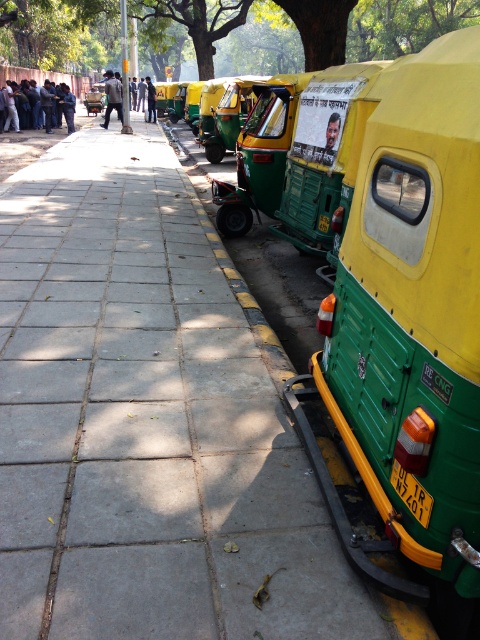
You are standing on the pavement near the auto rickshaws. You see two points marked on the ground at point coordinates point (116,19) and point (320,230). If you want to walk towards the nearest auto rickshaw, which point should you stand on?

You should stand on point (320,230) because it is in front of point (116,19), which is behind it.

You are standing on the road and see the point at coordinates (145, 422). Based on the scene description, what is located at that point?

The point at coordinates (145, 422) indicates the paved concrete sidewalk at center.